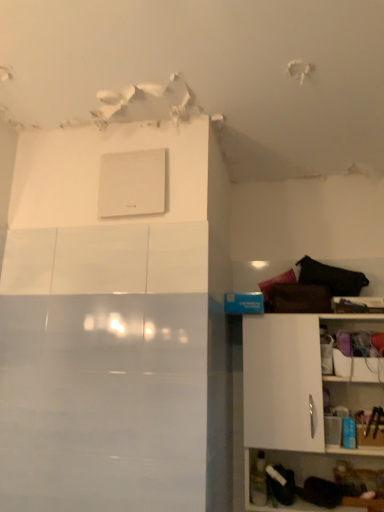
Question: Is point (150, 165) positioned closer to the camera than point (372, 385)?

Choices:
 (A) farther
 (B) closer

Answer: (B)

Question: From the image's perspective, is white matte switch at upper center above or below white matte cabinet at right?

Choices:
 (A) above
 (B) below

Answer: (A)

Question: Do you think white matte switch at upper center is within white matte cabinet at right, or outside of it?

Choices:
 (A) outside
 (B) inside

Answer: (A)

Question: In the image, is white matte cabinet at right positioned in front of or behind white matte switch at upper center?

Choices:
 (A) front
 (B) behind

Answer: (A)

Question: Visually, is white matte cabinet at right positioned to the left or to the right of white matte switch at upper center?

Choices:
 (A) left
 (B) right

Answer: (B)

Question: From the image's perspective, is white matte cabinet at right located above or below white matte switch at upper center?

Choices:
 (A) below
 (B) above

Answer: (A)

Question: Is point (283, 367) closer or farther from the camera than point (110, 204)?

Choices:
 (A) farther
 (B) closer

Answer: (A)